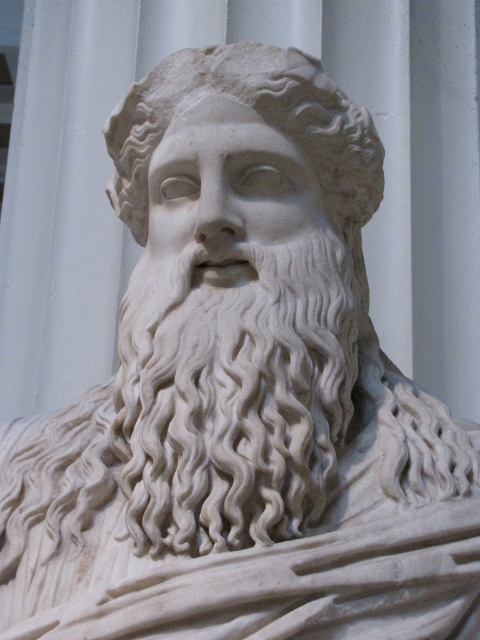
Question: Which point is closer to the camera?

Choices:
 (A) (337, 314)
 (B) (333, 216)

Answer: (A)

Question: Which object appears closest to the camera in this image?

Choices:
 (A) white marble head at center
 (B) white marble beard at center

Answer: (B)

Question: Does white marble beard at center appear over white marble head at center?

Choices:
 (A) no
 (B) yes

Answer: (A)

Question: In this image, where is white marble beard at center located relative to white marble head at center?

Choices:
 (A) left
 (B) right

Answer: (B)

Question: Is white marble beard at center behind white marble head at center?

Choices:
 (A) no
 (B) yes

Answer: (A)

Question: Among these objects, which one is farthest from the camera?

Choices:
 (A) white marble head at center
 (B) white marble beard at center

Answer: (A)